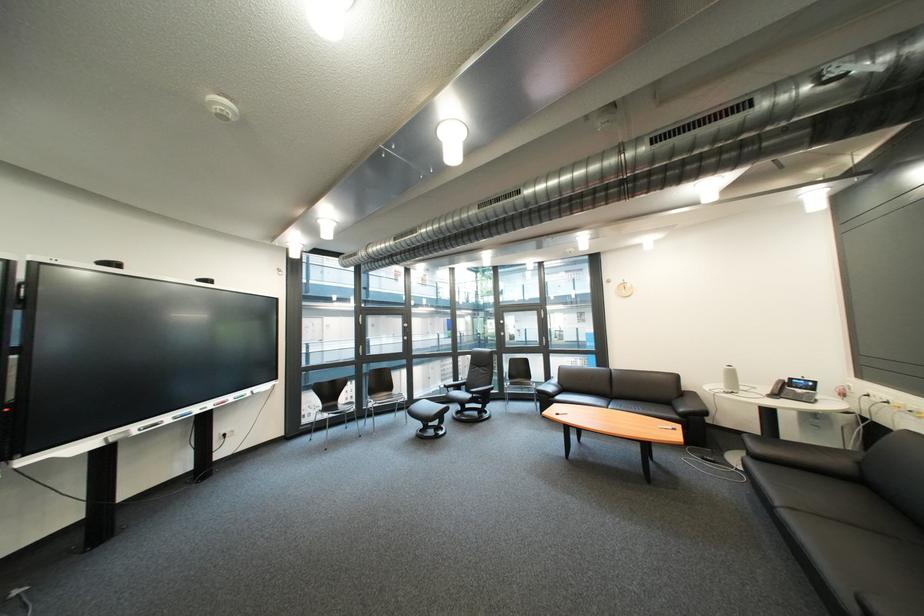
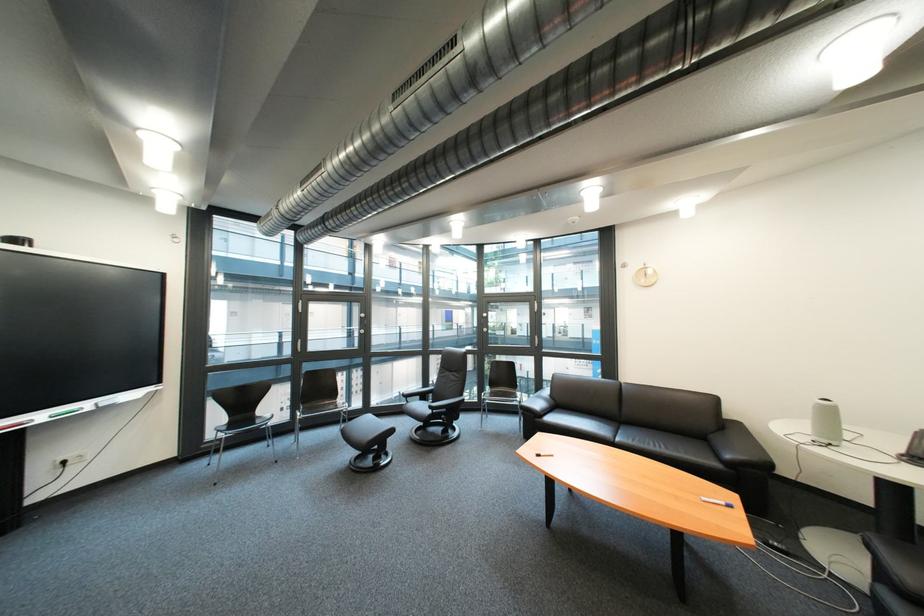
In the second image, find the point that corresponds to point 695,411 in the first image.

(742, 458)